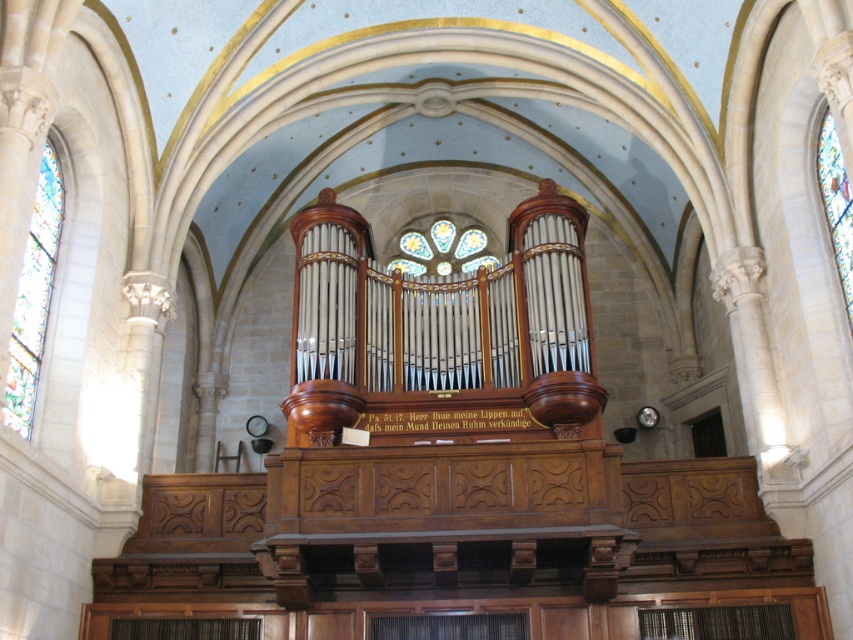
Question: Does stained glass at left have a smaller size compared to stained glass window at right?

Choices:
 (A) no
 (B) yes

Answer: (A)

Question: Does stained glass at left appear over stained glass window at right?

Choices:
 (A) yes
 (B) no

Answer: (B)

Question: Does stained glass at left have a lesser width compared to stained glass window at right?

Choices:
 (A) yes
 (B) no

Answer: (B)

Question: Which point is closer to the camera?

Choices:
 (A) stained glass window at right
 (B) stained glass at left

Answer: (B)